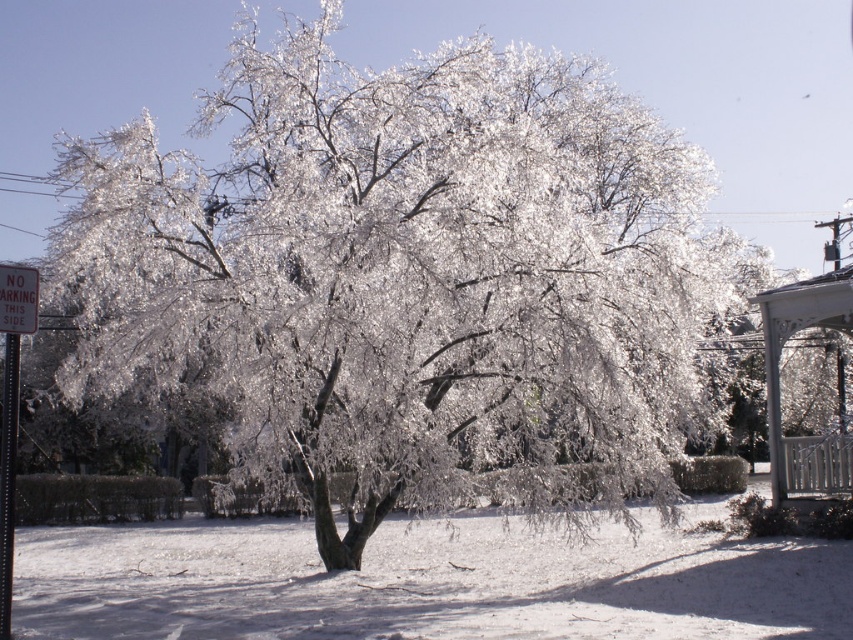
Question: Which point is closer to the camera taking this photo?

Choices:
 (A) (773, 467)
 (B) (33, 300)

Answer: (B)

Question: Which point appears closest to the camera in this image?

Choices:
 (A) (35, 305)
 (B) (770, 420)

Answer: (A)

Question: Is white painted wood gazebo at right thinner than red metal sign at upper left?

Choices:
 (A) yes
 (B) no

Answer: (B)

Question: Can you confirm if white painted wood gazebo at right is positioned above red metal sign at upper left?

Choices:
 (A) no
 (B) yes

Answer: (B)

Question: Does white painted wood gazebo at right appear on the right side of red metal sign at upper left?

Choices:
 (A) no
 (B) yes

Answer: (B)